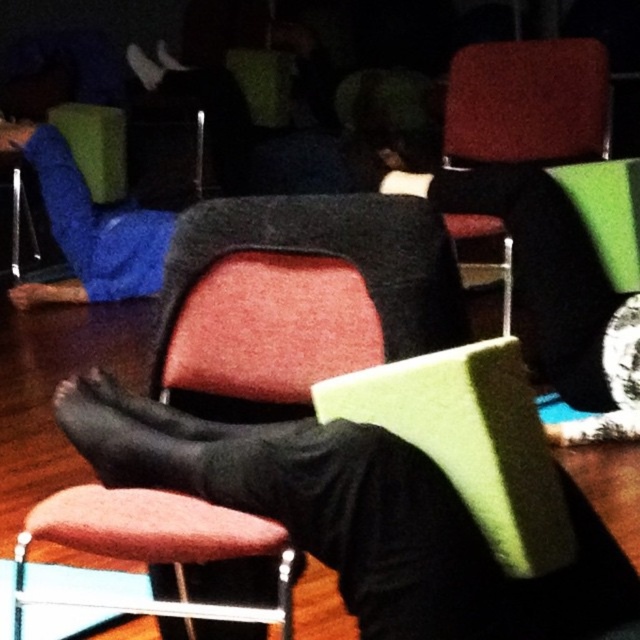
Question: Can you confirm if velvet-like red chair at center is positioned to the left of matte red armchair at upper right?

Choices:
 (A) no
 (B) yes

Answer: (B)

Question: Among these objects, which one is farthest from the camera?

Choices:
 (A) velvet pink stool at center
 (B) velvet-like red chair at center
 (C) black matte socks at lower center
 (D) matte red armchair at upper right

Answer: (D)

Question: Which point is farther from the camera taking this photo?

Choices:
 (A) (104, 548)
 (B) (164, 416)
 (C) (74, 404)

Answer: (B)

Question: Which point appears farthest from the camera in this image?

Choices:
 (A) click(237, 582)
 (B) click(500, 592)
 (C) click(182, 577)
 (D) click(592, 120)

Answer: (D)

Question: Where is black matte socks at lower center located in relation to velvet pink stool at center in the image?

Choices:
 (A) above
 (B) below

Answer: (A)

Question: Does velvet-like red chair at center have a smaller size compared to black matte socks at lower center?

Choices:
 (A) yes
 (B) no

Answer: (B)